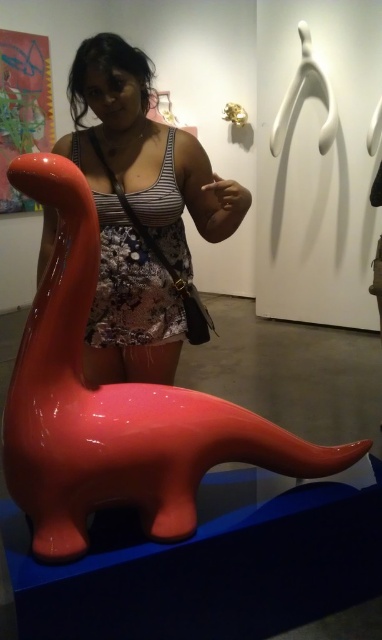
Between glossy plastic dinosaur at lower left and matte black tank top at center, which one has more height?

matte black tank top at center is taller.

Is point (59, 257) in front of point (140, 138)?

Yes, point (59, 257) is in front of point (140, 138).

Identify the location of glossy plastic dinosaur at lower left. The width and height of the screenshot is (382, 640). (114, 406).